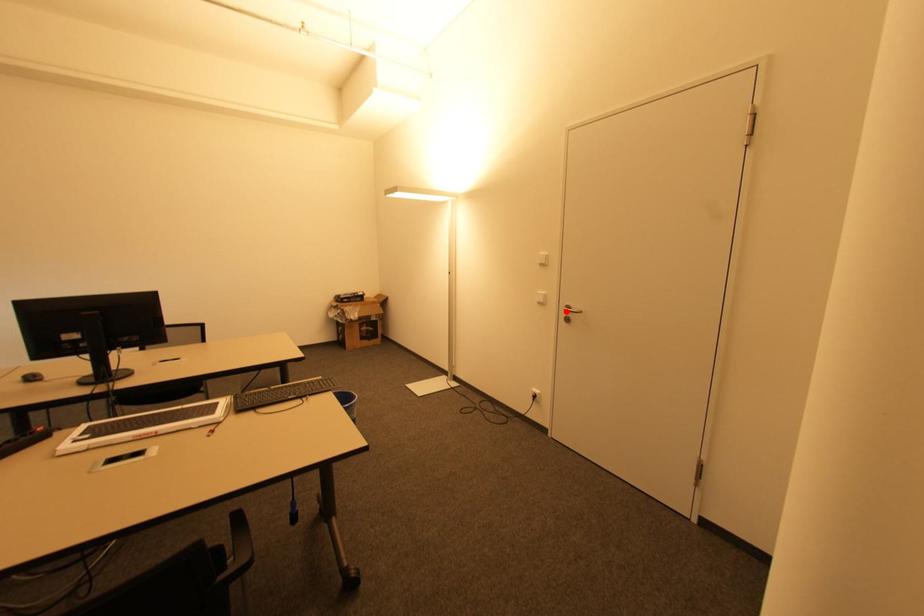
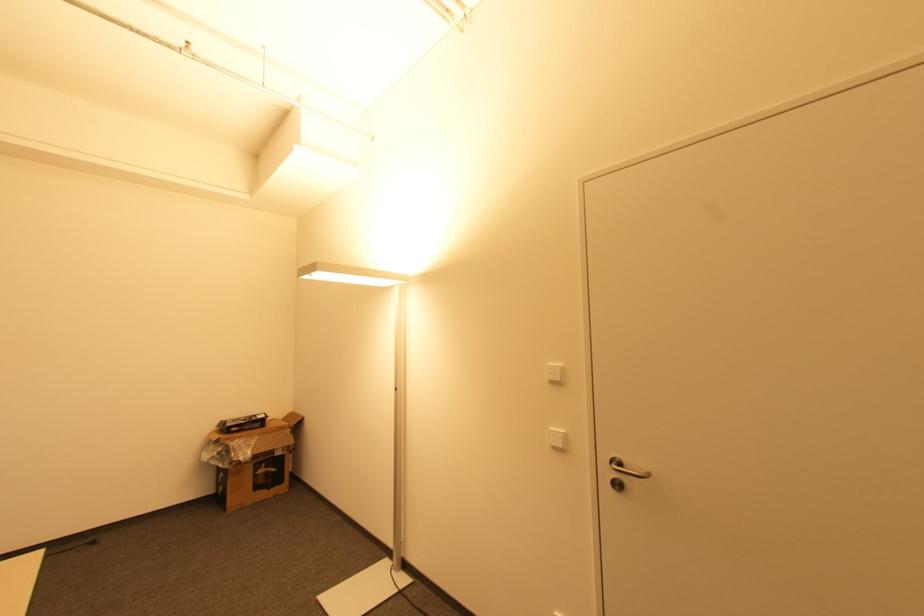
Find the pixel in the second image that matches the highlighted location in the first image.

(613, 469)